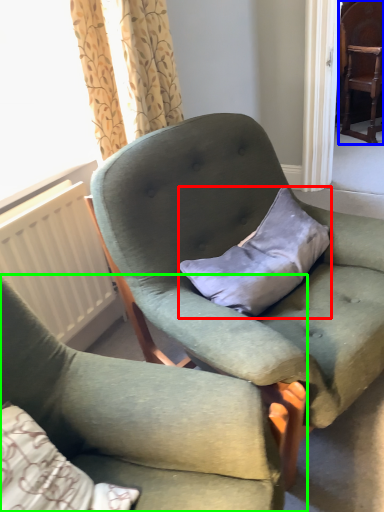
Question: Estimate the real-world distances between objects in this image. Which object is farther from pillow (highlighted by a red box), chair (highlighted by a blue box) or chair (highlighted by a green box)?

Choices:
 (A) chair
 (B) chair

Answer: (A)